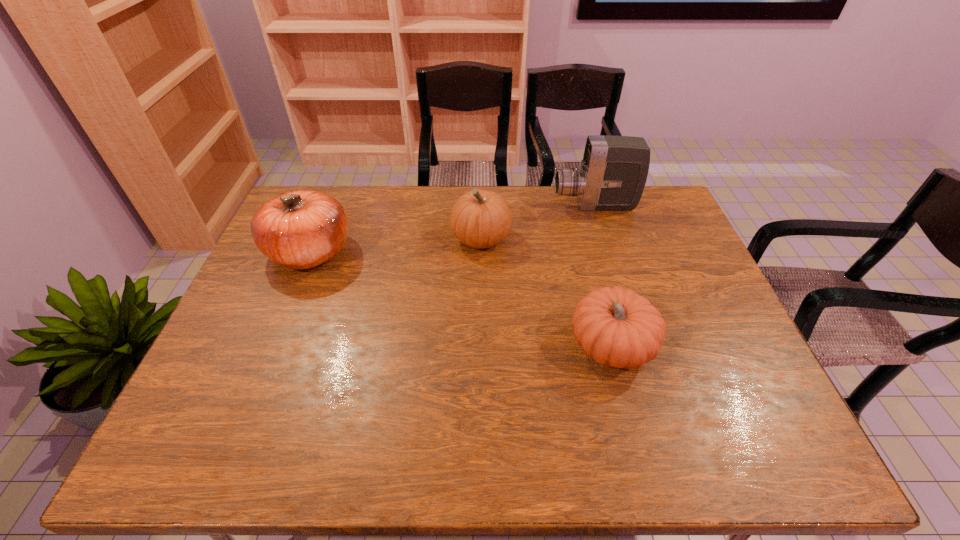
Locate an element on the screen. free location located 0.160m on the stem of the second pumpkin from left to right is located at coordinates (401, 239).

What are the coordinates of `blank area located 0.240m on the stem of the second pumpkin from left to right` in the screenshot? It's located at (376, 239).

I want to click on vacant region located 0.080m on the right of the leftmost object, so click(379, 252).

The image size is (960, 540). I want to click on vacant space located on the left of the nearest object, so click(545, 346).

Locate an element on the screen. camcorder that is positioned at the far edge is located at coordinates (613, 173).

Where is `object situated at the left edge`? This screenshot has height=540, width=960. object situated at the left edge is located at coordinates (301, 229).

Locate an element on the screen. This screenshot has width=960, height=540. object at the right edge is located at coordinates (613, 173).

You are a GUI agent. You are given a task and a screenshot of the screen. Output one action in this format:
    pyautogui.click(x=<x>, y=<y>)
    Task: Click on the object that is at the far left corner
    This screenshot has width=960, height=540.
    Given the screenshot: What is the action you would take?
    pyautogui.click(x=301, y=229)

You are a GUI agent. You are given a task and a screenshot of the screen. Output one action in this format:
    pyautogui.click(x=<x>, y=<y>)
    Task: Click on the object that is at the far right corner
    
    Given the screenshot: What is the action you would take?
    pyautogui.click(x=613, y=173)

You are a GUI agent. You are given a task and a screenshot of the screen. Output one action in this format:
    pyautogui.click(x=<x>, y=<y>)
    Task: Click on the free space at the far edge of the desktop
    This screenshot has width=960, height=540.
    Given the screenshot: What is the action you would take?
    pyautogui.click(x=613, y=218)